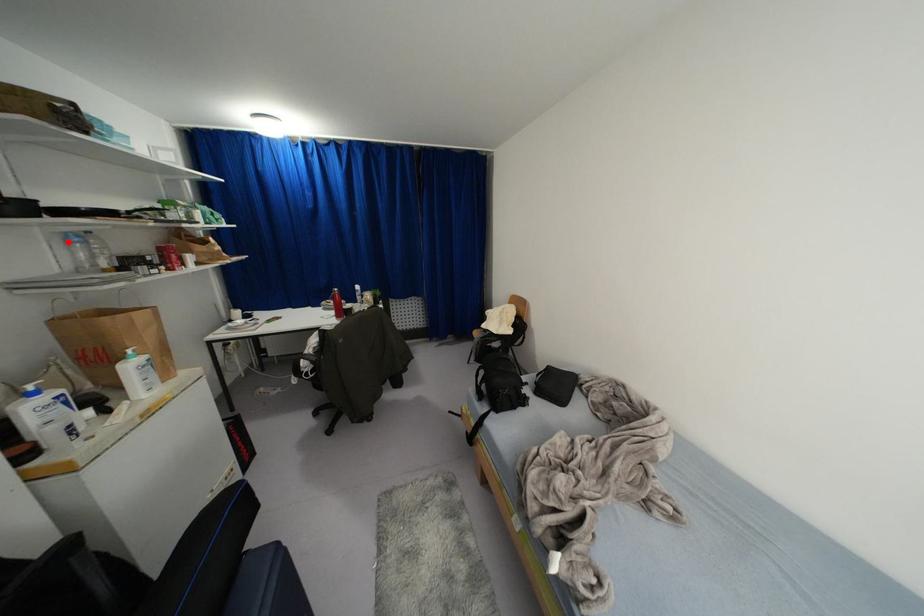
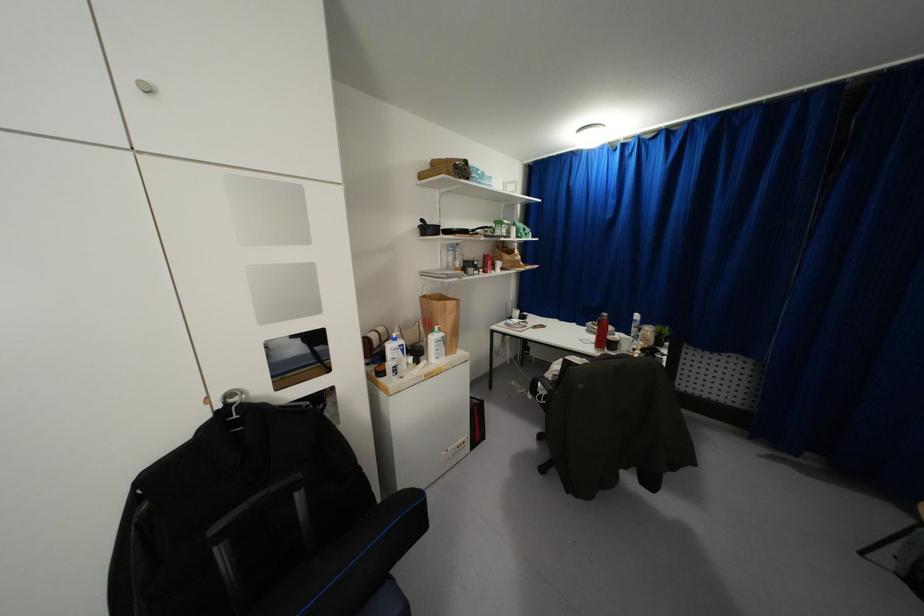
Question: A red point is marked in image1. In image2, is the corresponding 3D point closer to the camera or farther? Reply with the corresponding letter.

Choices:
 (A) The corresponding 3D point is closer.
 (B) The corresponding 3D point is farther.

Answer: (A)